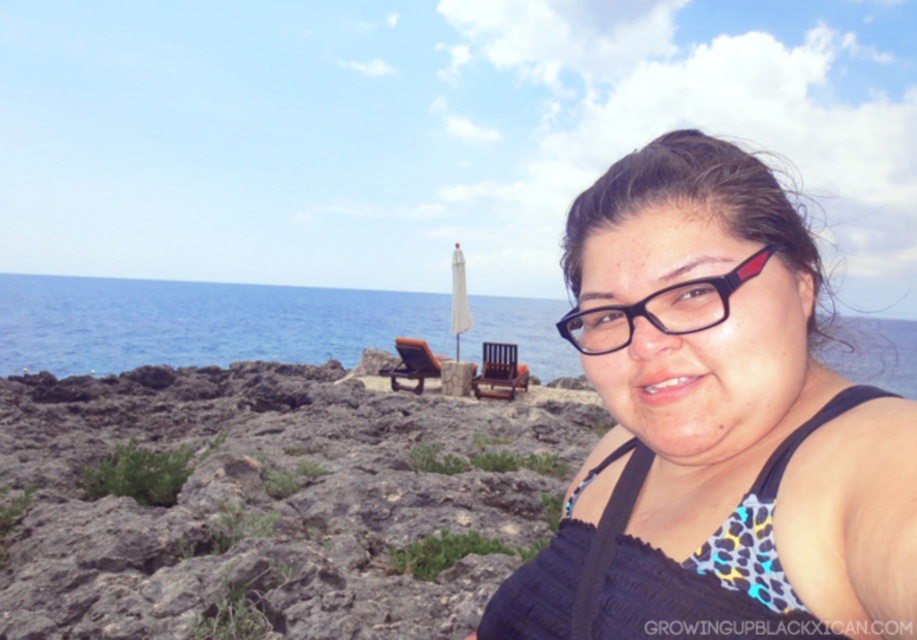
What is located at the coordinates point (x=715, y=428) in the image?

The coordinates point (x=715, y=428) marks the location of the black matte swimsuit at center.

You are a photographer trying to capture the reflection of the black plastic glasses at center in the blue water at center. Based on the scene, can you confirm if the reflection would be visible?

The blue water at center is positioned over the black plastic glasses at center, so the reflection of the black plastic glasses at center would not be visible in the blue water at center because the glasses are below the water.